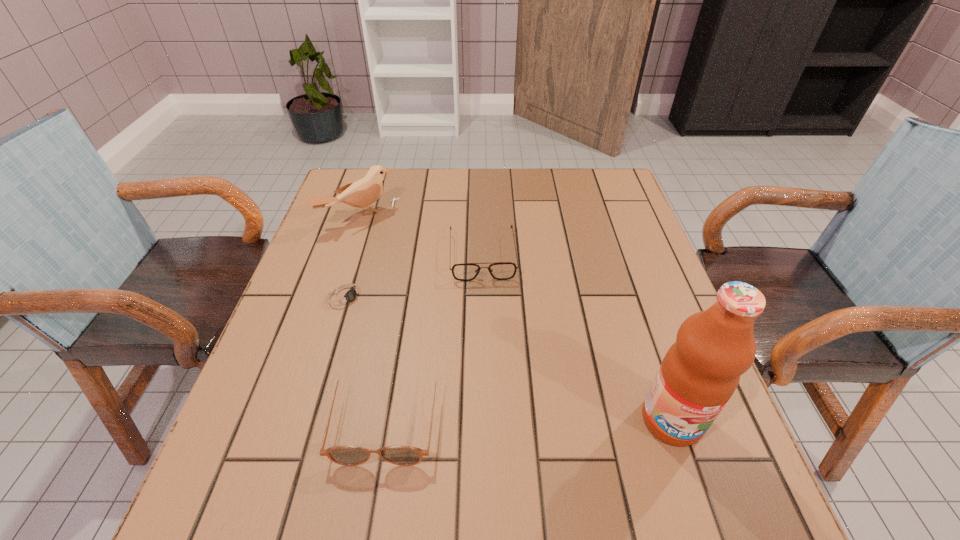
Locate an element on the screen. Image resolution: width=960 pixels, height=540 pixels. vacant space on the desktop that is between the left sunglasses and the tallest object and is positioned on the face of the shortest object is located at coordinates (541, 418).

The height and width of the screenshot is (540, 960). I want to click on free space on the desktop that is between the nearer sunglasses and the rightmost object and is positioned at the beak of the second tallest object, so click(x=565, y=418).

You are a GUI agent. You are given a task and a screenshot of the screen. Output one action in this format:
    pyautogui.click(x=<x>, y=<y>)
    Task: Click on the free space on the desktop that is between the nearer sunglasses and the rightmost object and is positioned on the front-facing side of the right sunglasses
    
    Given the screenshot: What is the action you would take?
    pyautogui.click(x=492, y=417)